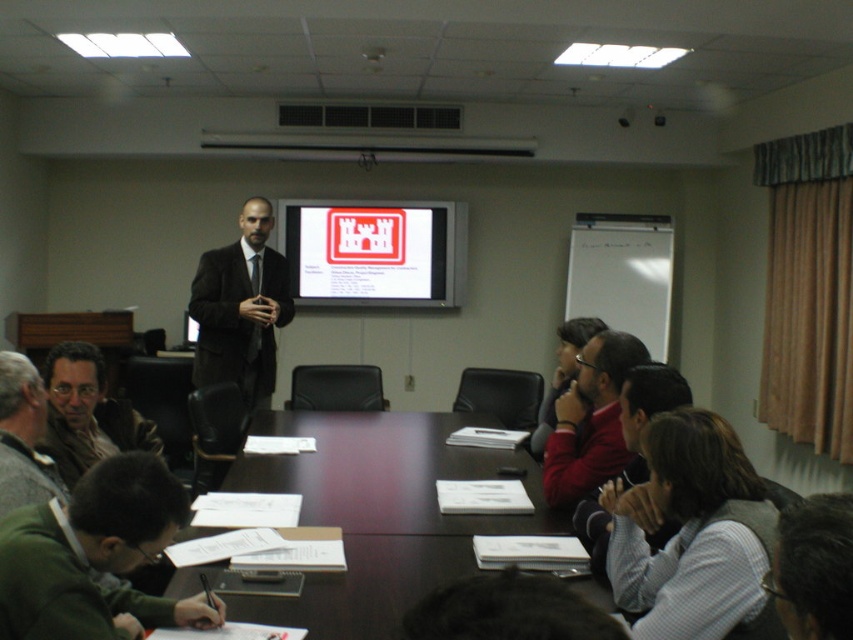
Is black matte suit at center closer to camera compared to matte brown jacket at lower left?

No, black matte suit at center is further to the viewer.

Image resolution: width=853 pixels, height=640 pixels. What do you see at coordinates (238, 317) in the screenshot?
I see `black matte suit at center` at bounding box center [238, 317].

You are a GUI agent. You are given a task and a screenshot of the screen. Output one action in this format:
    pyautogui.click(x=<x>, y=<y>)
    Task: Click on the black matte suit at center
    
    Given the screenshot: What is the action you would take?
    pyautogui.click(x=238, y=317)

Looking at this image, how much distance is there between matte plastic projector screen at center and matte brown jacket at lower left?

matte plastic projector screen at center and matte brown jacket at lower left are 11.42 feet apart.

Who is taller, matte plastic projector screen at center or matte brown jacket at lower left?

matte plastic projector screen at center

The height and width of the screenshot is (640, 853). I want to click on matte plastic projector screen at center, so click(x=373, y=252).

This screenshot has height=640, width=853. Find the location of `matte plastic projector screen at center`. matte plastic projector screen at center is located at coordinates (373, 252).

Does dark wood table at center have a lesser width compared to black matte suit at center?

In fact, dark wood table at center might be wider than black matte suit at center.

Between dark wood table at center and black matte suit at center, which one has more height?

black matte suit at center is taller.

Is point (398, 525) closer to camera compared to point (207, 336)?

Yes, point (398, 525) is in front of point (207, 336).

Locate an element on the screen. This screenshot has width=853, height=640. dark wood table at center is located at coordinates (376, 515).